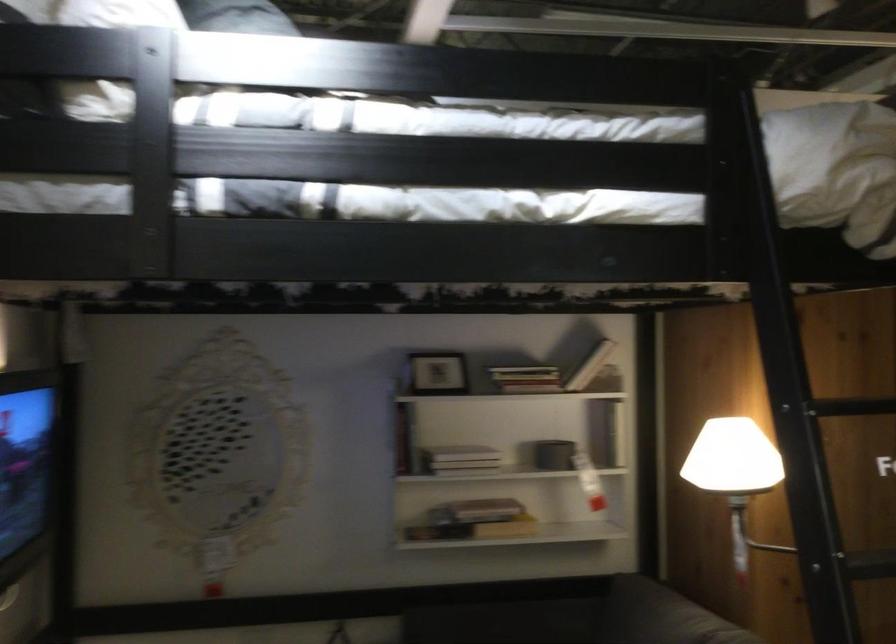
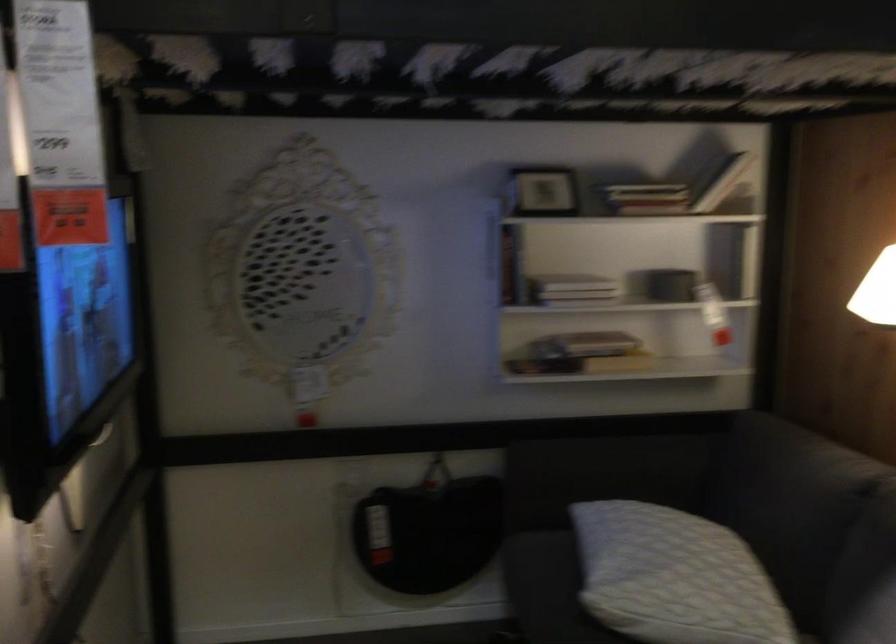
Question: Based on the continuous images, in which direction is the camera rotating? Reply with the corresponding letter.

Choices:
 (A) Left
 (B) Right
 (C) Up
 (D) Down

Answer: (D)